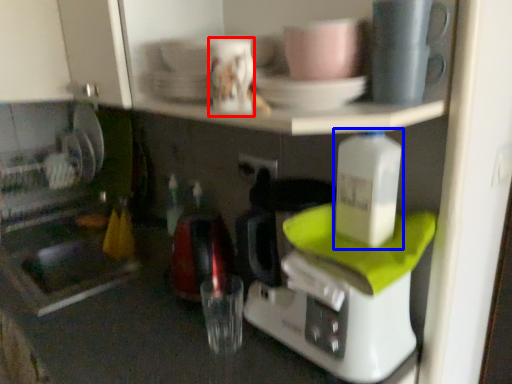
Question: Which of the following is the farthest to the observer, coffee cup (highlighted by a red box) or bottle (highlighted by a blue box)?

Choices:
 (A) coffee cup
 (B) bottle

Answer: (A)